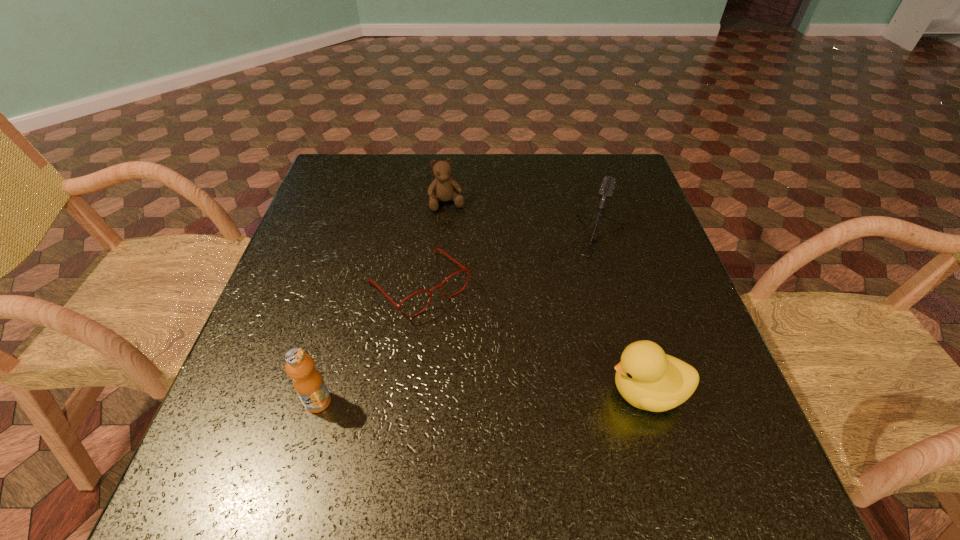
Where is `vacant space on the desktop that is between the leftmost object and the duck and is positioned on the front-facing side of the teddy bear`? This screenshot has height=540, width=960. vacant space on the desktop that is between the leftmost object and the duck and is positioned on the front-facing side of the teddy bear is located at coordinates coord(506,396).

The image size is (960, 540). I want to click on free spot on the desktop that is between the orange juice and the duck and is positioned on the face of the shortest object, so click(516, 396).

The width and height of the screenshot is (960, 540). Identify the location of free space on the desktop that is between the leftmost object and the duck and is positioned on the stand of the microphone. (527, 395).